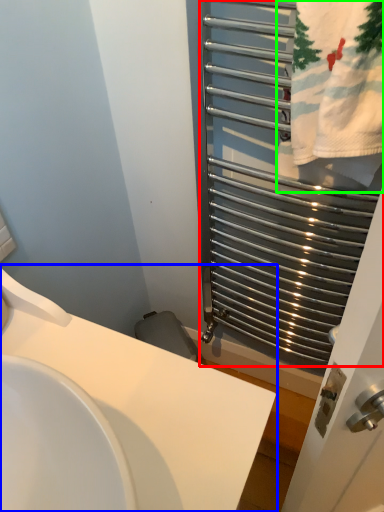
Question: Based on their relative distances, which object is nearer to cage (highlighted by a red box)? Choose from sink (highlighted by a blue box) and bath towel (highlighted by a green box).

Choices:
 (A) sink
 (B) bath towel

Answer: (B)